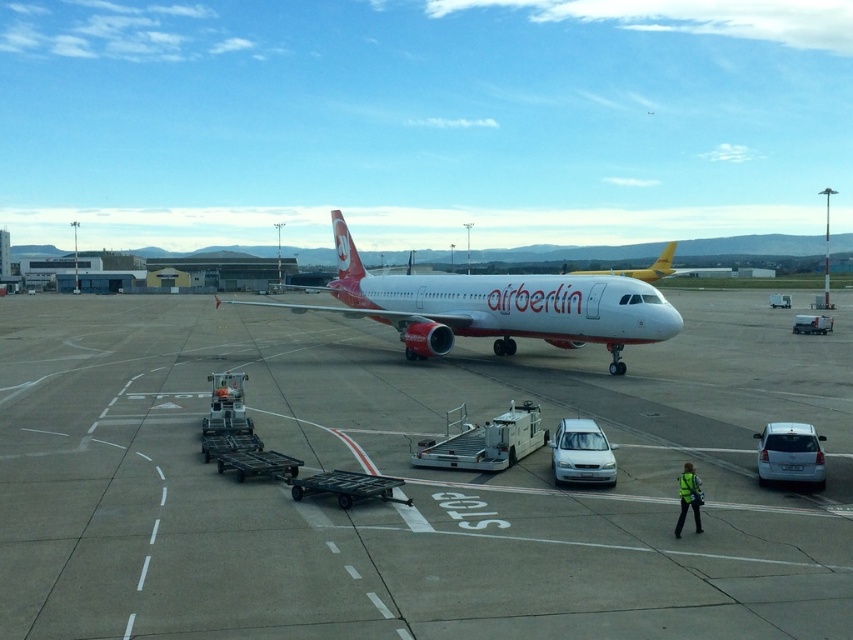
You are standing at point (495, 307) on the airport tarmac. Looking around, you see a white glossy airplane at center. What is directly beneath your feet?

The point at (495, 307) is directly beneath your feet, and at that location lies the white glossy airplane at center.

You are standing at point (506, 294) and want to reach the airberlin airplane. The distance between you and the airplane is 26.54 meters. If you walk at a speed of 1.5 meters per second, how many seconds will it take you to reach the airplane?

The distance between you and the airplane is 26.54 meters. At a walking speed of 1.5 meters per second, it will take approximately 26.54 divided by 1.5, which equals about 17.69 seconds. So, it will take roughly 17.7 seconds to reach the airplane.

You are a delivery person needing to place a heavy crate on the white smooth tarmac at center. However, there is a white glossy airplane at center in the way. Can you move the crate to the tarmac without hitting the airplane?

The white smooth tarmac at center is on the right side of the white glossy airplane at center, so you can move the crate to the tarmac by placing it to the right of the airplane without obstruction.